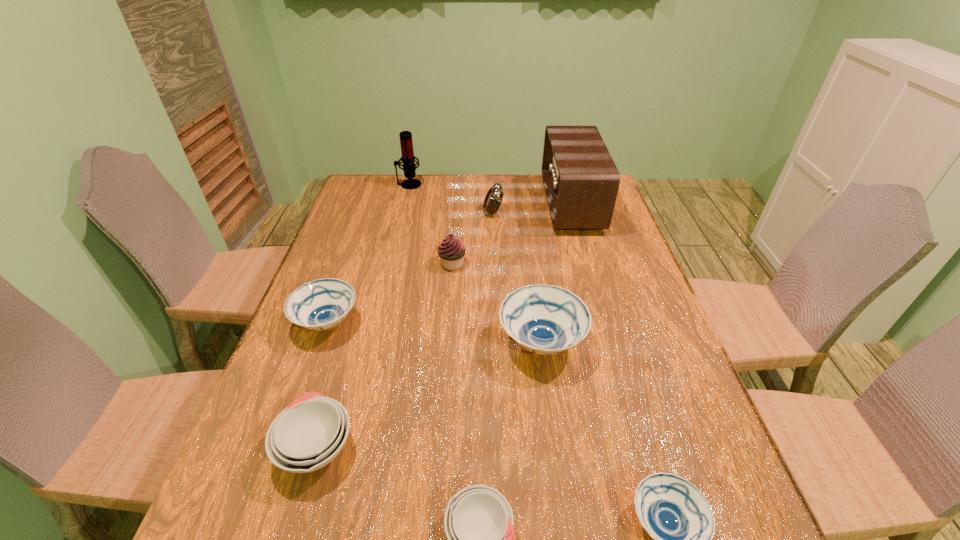
You are a GUI agent. You are given a task and a screenshot of the screen. Output one action in this format:
    pyautogui.click(x=<x>, y=<y>)
    Task: Click on the vacant space located 0.100m on the back of the left white soup bowl
    Image resolution: width=960 pixels, height=540 pixels.
    Given the screenshot: What is the action you would take?
    pyautogui.click(x=339, y=371)

Find the location of a particular element. This screenshot has width=960, height=540. radio receiver present at the far edge is located at coordinates (581, 181).

The height and width of the screenshot is (540, 960). I want to click on microphone that is at the far edge, so click(408, 159).

You are a GUI agent. You are given a task and a screenshot of the screen. Output one action in this format:
    pyautogui.click(x=<x>, y=<y>)
    Task: Click on the alarm clock located in the far edge section of the desktop
    Image resolution: width=960 pixels, height=540 pixels.
    Given the screenshot: What is the action you would take?
    pyautogui.click(x=493, y=199)

Image resolution: width=960 pixels, height=540 pixels. In order to click on microphone that is at the left edge in this screenshot , I will do `click(408, 159)`.

Find the location of a particular element. object at the right edge is located at coordinates (581, 181).

Locate an element on the screen. The height and width of the screenshot is (540, 960). object situated at the far left corner is located at coordinates (408, 159).

This screenshot has height=540, width=960. What are the coordinates of `object that is at the far right corner` in the screenshot? It's located at (581, 181).

Find the location of `free spot at the far edge of the desktop`. free spot at the far edge of the desktop is located at coordinates (466, 184).

I want to click on vacant space at the left edge, so click(x=307, y=351).